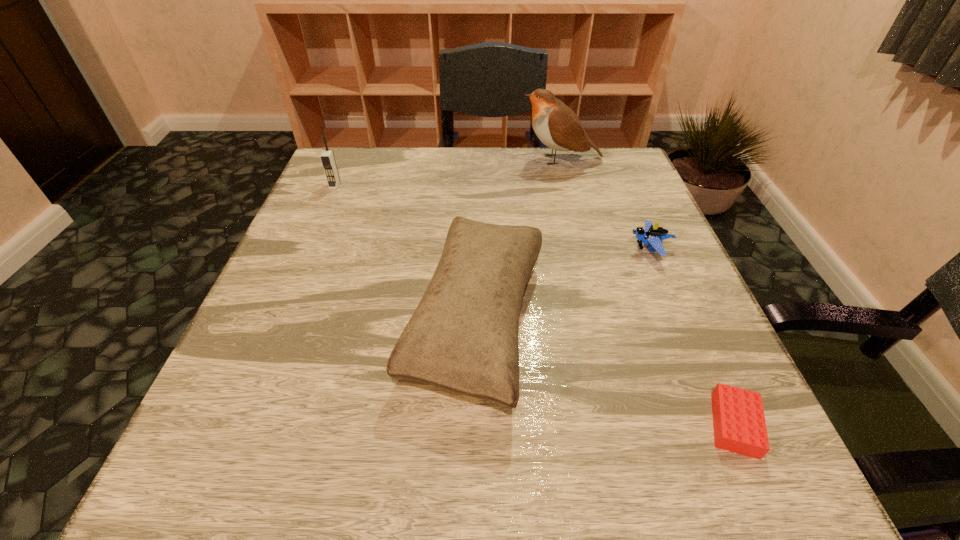
Identify the location of object present at the near edge. The image size is (960, 540). (739, 424).

Find the location of a particular element. The image size is (960, 540). object at the left edge is located at coordinates pos(327,157).

Identify the location of bird that is at the right edge. (557, 126).

Identify the location of object that is at the far left corner. (x=327, y=157).

The width and height of the screenshot is (960, 540). I want to click on object present at the far right corner, so (557, 126).

At what (x,y) coordinates should I click in order to perform the action: click on object that is at the near right corner. Please return your answer as a coordinate pair (x, y). Looking at the image, I should click on (739, 424).

Identify the location of blank space at the far edge. This screenshot has width=960, height=540. (500, 151).

In the image, there is a desktop. At what (x,y) coordinates should I click in order to perform the action: click on vacant space at the near edge. Please return your answer as a coordinate pair (x, y). Image resolution: width=960 pixels, height=540 pixels. Looking at the image, I should click on (592, 509).

Where is `free region at the left edge`? The width and height of the screenshot is (960, 540). free region at the left edge is located at coordinates (294, 393).

In the image, there is a desktop. What are the coordinates of `vacant region at the right edge` in the screenshot? It's located at (628, 240).